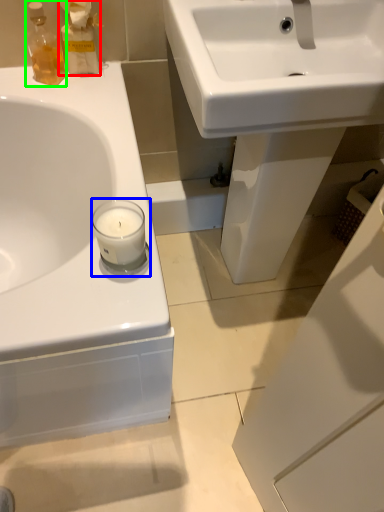
Question: Considering the real-world distances, which object is farthest from cleaning product (highlighted by a red box)? candle holder (highlighted by a blue box) or toiletry (highlighted by a green box)?

Choices:
 (A) candle holder
 (B) toiletry

Answer: (A)